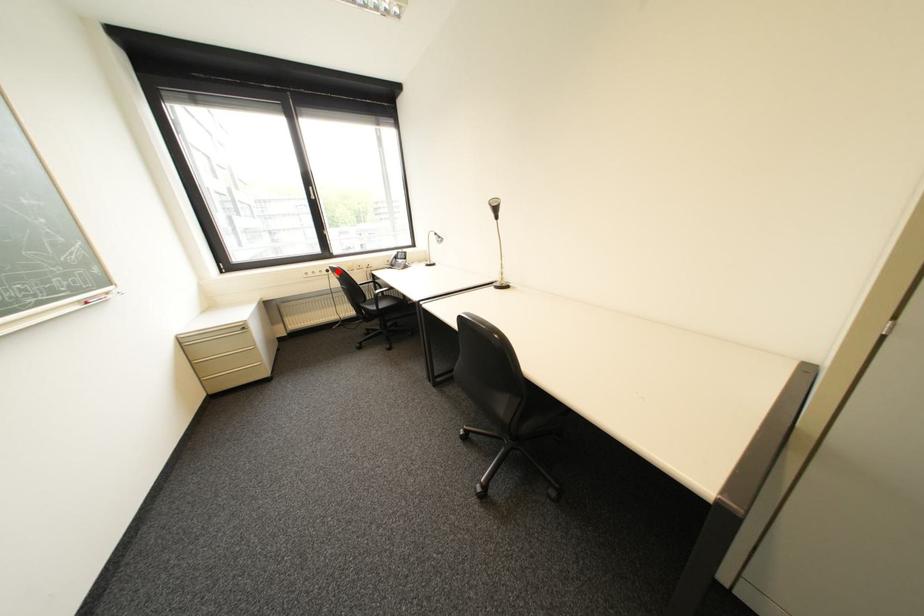
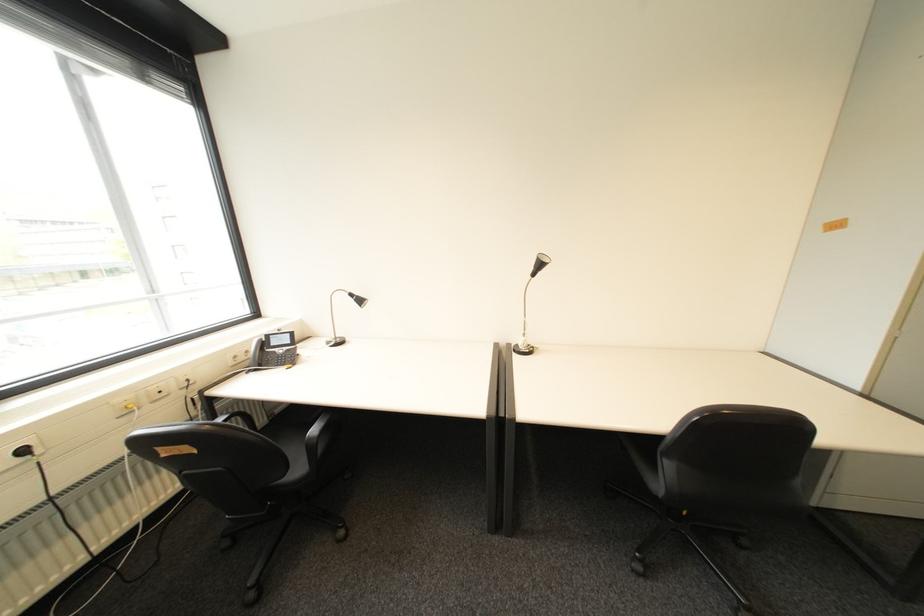
Question: I am providing you with two images of the same scene from different viewpoints. Image1 has a red point marked. In image2, the corresponding 3D location appears at what relative position? Reply with the corresponding letter.

Choices:
 (A) Closer
 (B) Farther

Answer: (B)